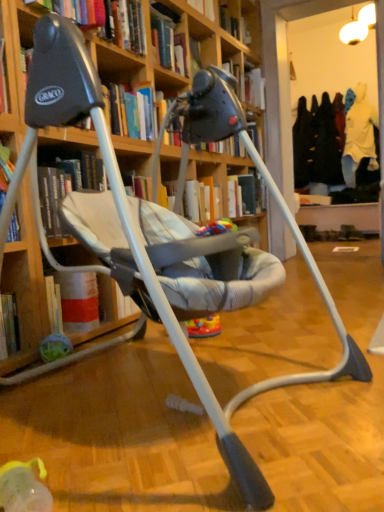
Question: Should I look upward or downward to see hardcover book at upper center, which appears as the second book when viewed from the left?

Choices:
 (A) up
 (B) down

Answer: (A)

Question: Would you say hardcover book at upper center, which appears as the second book when viewed from the left, is outside multicolored plastic toy at center?

Choices:
 (A) no
 (B) yes

Answer: (B)

Question: From a real-world perspective, is hardcover book at upper center, the 3th book viewed from the top, over multicolored plastic toy at center?

Choices:
 (A) yes
 (B) no

Answer: (A)

Question: Is hardcover book at upper center, which appears as the second book when viewed from the left, oriented away from multicolored plastic toy at center?

Choices:
 (A) yes
 (B) no

Answer: (B)

Question: Does hardcover book at upper center, which appears as the second book when viewed from the back, have a larger size compared to multicolored plastic toy at center?

Choices:
 (A) yes
 (B) no

Answer: (A)

Question: Considering the relative positions of hardcover book at upper center, arranged as the second book when viewed from the right, and multicolored plastic toy at center in the image provided, is hardcover book at upper center, arranged as the second book when viewed from the right, to the right of multicolored plastic toy at center from the viewer's perspective?

Choices:
 (A) no
 (B) yes

Answer: (A)

Question: Can you confirm if hardcover book at upper center, which appears as the second book when viewed from the back, is taller than multicolored plastic toy at center?

Choices:
 (A) yes
 (B) no

Answer: (A)

Question: Does multicolored plastic toy at center have a smaller size compared to wooden bookcase at center?

Choices:
 (A) yes
 (B) no

Answer: (A)

Question: Considering the relative positions of multicolored plastic toy at center and wooden bookcase at center in the image provided, is multicolored plastic toy at center to the left of wooden bookcase at center from the viewer's perspective?

Choices:
 (A) yes
 (B) no

Answer: (B)

Question: From the image's perspective, would you say multicolored plastic toy at center is positioned over wooden bookcase at center?

Choices:
 (A) no
 (B) yes

Answer: (A)

Question: Is multicolored plastic toy at center further to the viewer compared to wooden bookcase at center?

Choices:
 (A) no
 (B) yes

Answer: (B)

Question: Is multicolored plastic toy at center aimed at wooden bookcase at center?

Choices:
 (A) no
 (B) yes

Answer: (B)

Question: Is multicolored plastic toy at center positioned before wooden bookcase at center?

Choices:
 (A) no
 (B) yes

Answer: (A)

Question: Does wooden bookcase at center have a greater width compared to hardcover book at upper center, which is counted as the 2th book, starting from the top?

Choices:
 (A) yes
 (B) no

Answer: (A)